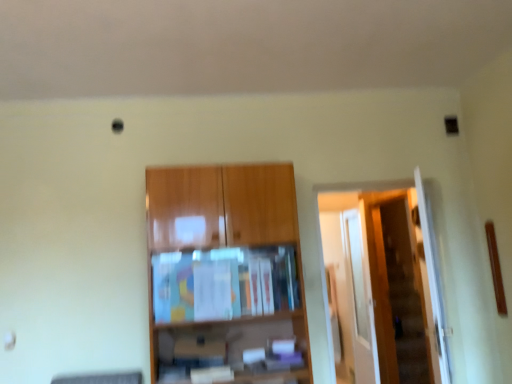
Question: Is transparent glass door at right to the left of wooden cabinet at center from the viewer's perspective?

Choices:
 (A) no
 (B) yes

Answer: (A)

Question: Considering the relative sizes of transparent glass door at right and wooden cabinet at center in the image provided, is transparent glass door at right smaller than wooden cabinet at center?

Choices:
 (A) yes
 (B) no

Answer: (A)

Question: Is transparent glass door at right with wooden cabinet at center?

Choices:
 (A) yes
 (B) no

Answer: (B)

Question: From the image's perspective, is transparent glass door at right beneath wooden cabinet at center?

Choices:
 (A) no
 (B) yes

Answer: (B)

Question: Is transparent glass door at right far from wooden cabinet at center?

Choices:
 (A) no
 (B) yes

Answer: (B)

Question: Can you confirm if transparent glass door at right is positioned to the right of wooden cabinet at center?

Choices:
 (A) no
 (B) yes

Answer: (B)

Question: Is transparent glass door at right taller than wooden door at right?

Choices:
 (A) no
 (B) yes

Answer: (B)

Question: Can you confirm if transparent glass door at right is positioned to the right of wooden door at right?

Choices:
 (A) yes
 (B) no

Answer: (A)

Question: Is transparent glass door at right bigger than wooden door at right?

Choices:
 (A) no
 (B) yes

Answer: (A)

Question: Is transparent glass door at right smaller than wooden door at right?

Choices:
 (A) yes
 (B) no

Answer: (A)

Question: Are transparent glass door at right and wooden door at right far apart?

Choices:
 (A) yes
 (B) no

Answer: (B)

Question: Does transparent glass door at right have a lesser height compared to wooden door at right?

Choices:
 (A) no
 (B) yes

Answer: (A)

Question: Can you confirm if wooden cabinet at center is taller than transparent glass door at right?

Choices:
 (A) yes
 (B) no

Answer: (B)